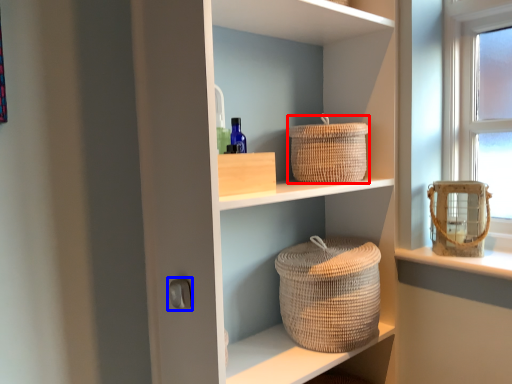
Question: Among these objects, which one is nearest to the camera, basket (highlighted by a red box) or door handle (highlighted by a blue box)?

Choices:
 (A) basket
 (B) door handle

Answer: (B)